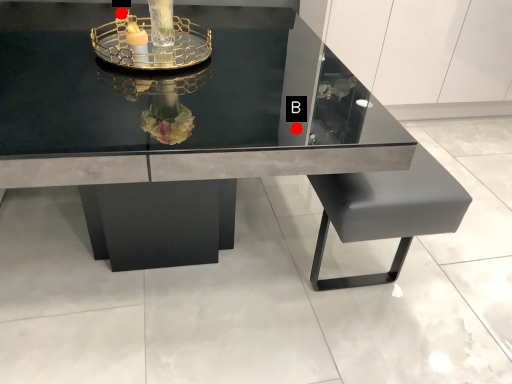
Question: Two points are circled on the image, labeled by A and B beside each circle. Among these points, which one is farthest from the camera?

Choices:
 (A) A is further
 (B) B is further

Answer: (A)